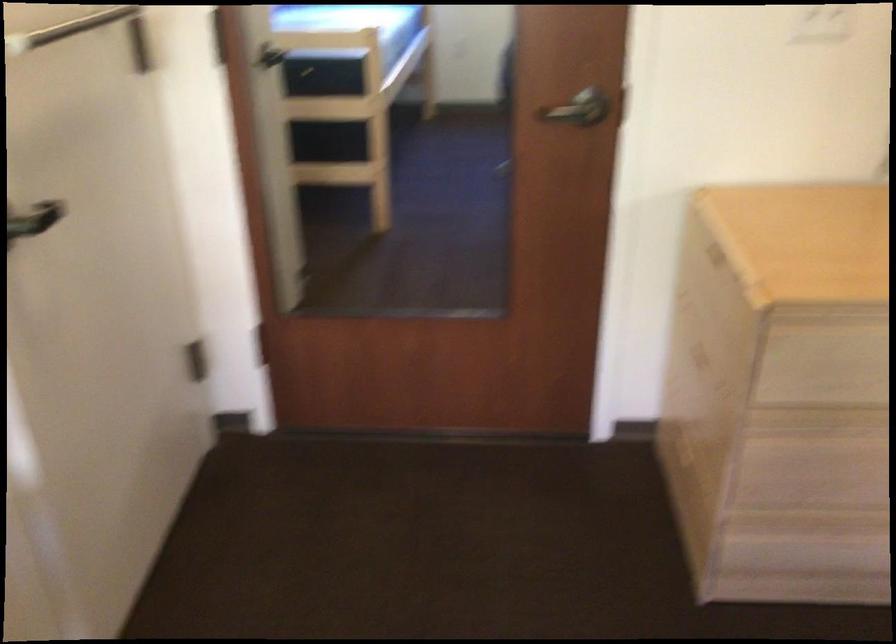
This screenshot has width=896, height=644. Describe the element at coordinates (583, 111) in the screenshot. I see `a black door handle` at that location.